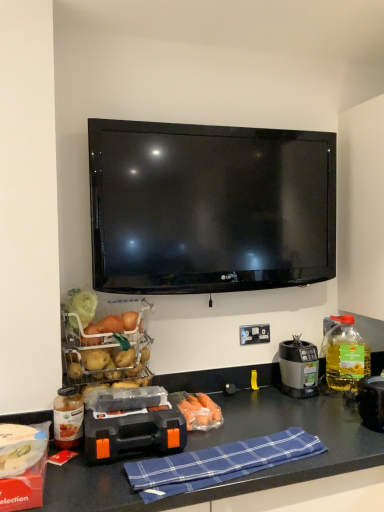
Question: Can you confirm if black plastic blender at right is taller than orange plastic toolbox at center?

Choices:
 (A) no
 (B) yes

Answer: (B)

Question: Does black plastic blender at right have a lesser height compared to orange plastic toolbox at center?

Choices:
 (A) yes
 (B) no

Answer: (B)

Question: Can you confirm if black plastic blender at right is wider than orange plastic toolbox at center?

Choices:
 (A) yes
 (B) no

Answer: (B)

Question: Is black plastic blender at right further to the viewer compared to orange plastic toolbox at center?

Choices:
 (A) yes
 (B) no

Answer: (A)

Question: From the image's perspective, is black plastic blender at right beneath orange plastic toolbox at center?

Choices:
 (A) yes
 (B) no

Answer: (B)

Question: From a real-world perspective, is black plastic blender at right physically above orange plastic toolbox at center?

Choices:
 (A) no
 (B) yes

Answer: (B)

Question: From a real-world perspective, is translucent glass jar at lower left, which appears as the 2th bottle when viewed from the back, located higher than yellow translucent bottle at right, marked as the 1th bottle in a right-to-left arrangement?

Choices:
 (A) no
 (B) yes

Answer: (A)

Question: Does translucent glass jar at lower left, the first bottle in the front-to-back sequence, have a larger size compared to yellow translucent bottle at right, marked as the 1th bottle in a right-to-left arrangement?

Choices:
 (A) yes
 (B) no

Answer: (B)

Question: From the image's perspective, is translucent glass jar at lower left, the 1th bottle in the left-to-right sequence, beneath yellow translucent bottle at right, the second bottle viewed from the left?

Choices:
 (A) no
 (B) yes

Answer: (B)

Question: Is yellow translucent bottle at right, the second bottle viewed from the left, located within translucent glass jar at lower left, the 1th bottle in the left-to-right sequence?

Choices:
 (A) no
 (B) yes

Answer: (A)

Question: Is translucent glass jar at lower left, the 1th bottle in the left-to-right sequence, not inside yellow translucent bottle at right, the second bottle viewed from the left?

Choices:
 (A) no
 (B) yes

Answer: (B)

Question: Is translucent glass jar at lower left, which appears as the 2th bottle when viewed from the back, further to camera compared to yellow translucent bottle at right, the second bottle viewed from the left?

Choices:
 (A) yes
 (B) no

Answer: (B)

Question: Is translucent glass jar at lower left, the first bottle in the front-to-back sequence, oriented towards matte red box at lower left?

Choices:
 (A) no
 (B) yes

Answer: (A)